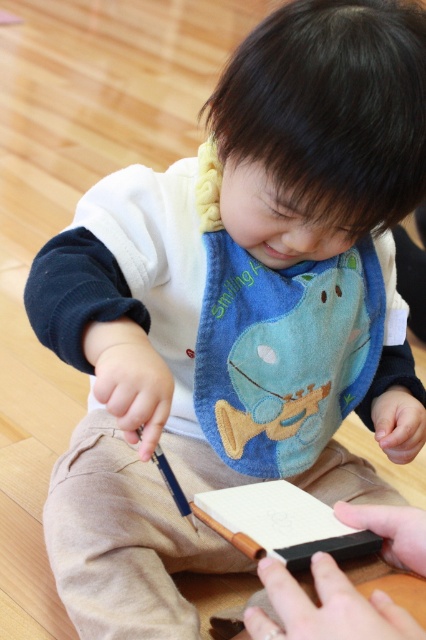
Question: Which object is closer to the camera taking this photo?

Choices:
 (A) black matte pencil at center
 (B) white matte notebook at center

Answer: (B)

Question: In this image, where is white matte notebook at center located relative to black matte pencil at center?

Choices:
 (A) below
 (B) above

Answer: (B)

Question: From the image, what is the correct spatial relationship of white matte notebook at center in relation to black matte pencil at center?

Choices:
 (A) right
 (B) left

Answer: (A)

Question: Which point appears farthest from the camera in this image?

Choices:
 (A) (167, 486)
 (B) (298, 525)

Answer: (A)

Question: Can you confirm if white matte notebook at center is positioned to the left of black matte pencil at center?

Choices:
 (A) yes
 (B) no

Answer: (B)